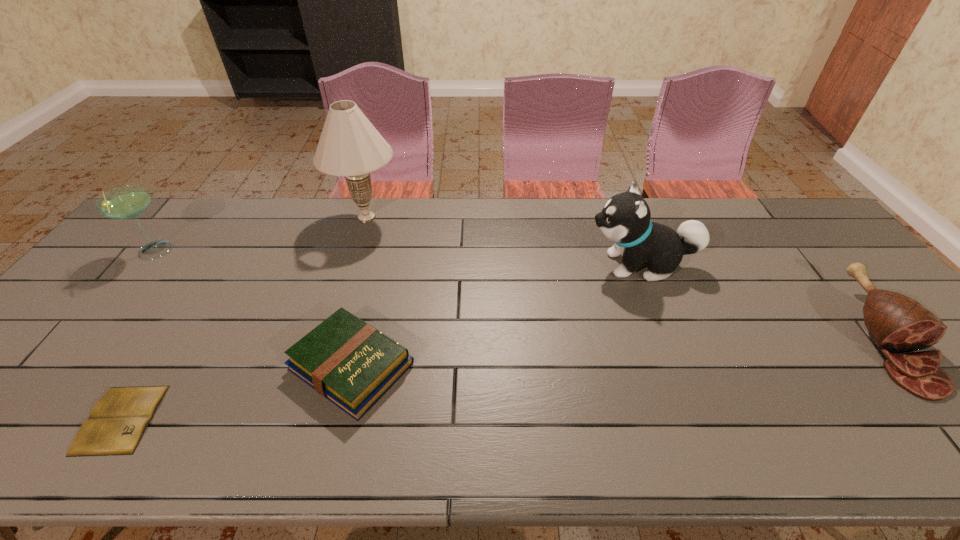
Identify the location of lampshade. This screenshot has height=540, width=960. (349, 145).

Where is `puppy`? Image resolution: width=960 pixels, height=540 pixels. puppy is located at coordinates (625, 219).

The image size is (960, 540). In order to click on the fifth object from left to right in this screenshot , I will do `click(625, 219)`.

Where is `the fourth shortest object`? This screenshot has width=960, height=540. the fourth shortest object is located at coordinates (127, 202).

Where is `martini`? This screenshot has width=960, height=540. martini is located at coordinates (127, 202).

The height and width of the screenshot is (540, 960). In order to click on the second shortest object in this screenshot , I will do 351,363.

Find the location of `the taller book`. the taller book is located at coordinates (351, 363).

The height and width of the screenshot is (540, 960). Find the location of `the fifth object from right to left`. the fifth object from right to left is located at coordinates (116, 424).

Find the location of a particular element. the shortest object is located at coordinates (116, 424).

This screenshot has width=960, height=540. Identify the location of vacant area situated 0.280m on the left of the tallest object. (248, 217).